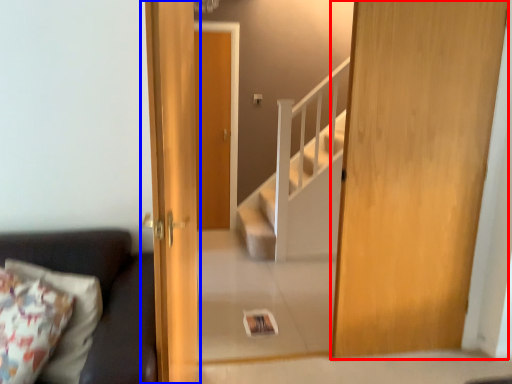
Question: Which of the following is the farthest to the observer, door (highlighted by a red box) or door (highlighted by a blue box)?

Choices:
 (A) door
 (B) door

Answer: (A)